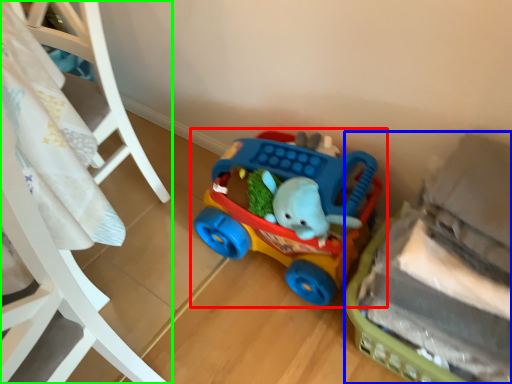
Question: Which object is positioned farthest from toy (highlighted by a red box)? Select from toy (highlighted by a blue box) and furniture (highlighted by a green box).

Choices:
 (A) toy
 (B) furniture

Answer: (B)